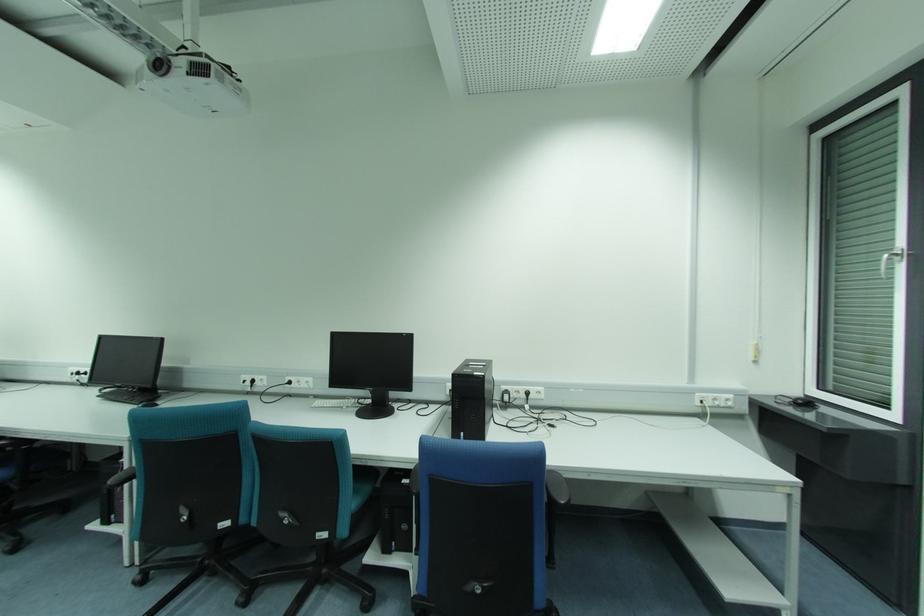
What do you see at coordinates (883, 265) in the screenshot?
I see `the white window handle` at bounding box center [883, 265].